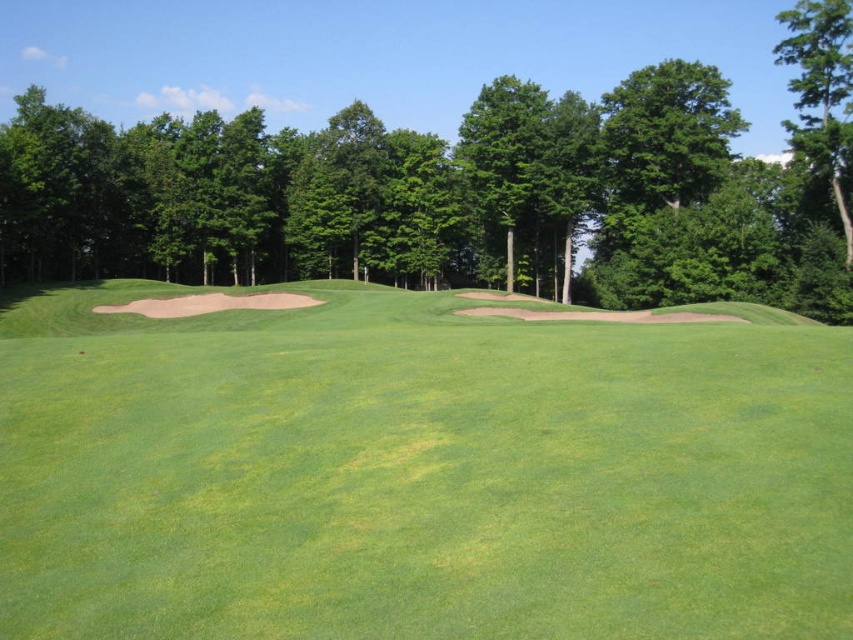
You are a golfer standing at the tee box and want to hit the ball towards the green. There is a green leafy tree at center in your way. Based on its 2D coordinates, can you estimate whether the tree is positioned to the left or right of the fairway centerline?

The green leafy tree at center is located at coordinates point (463, 189). Since the coordinates are given as a point on the image plane, the x and y values represent horizontal and vertical positions respectively. In standard image coordinate systems, the origin is typically at the top left corner. However, without additional context about the coordinate system orientation or the fairway centerline position, it is impossible to definitively determine if the tree is left or right of the centerline. More 2

You are a golfer standing on the green grassy field at center and want to hit a ball towards the green leafy tree at upper right. Which object will you see first if you look straight ahead?

The green grassy field at center will be seen first because it is closer to you than the green leafy tree at upper right, which is further away.